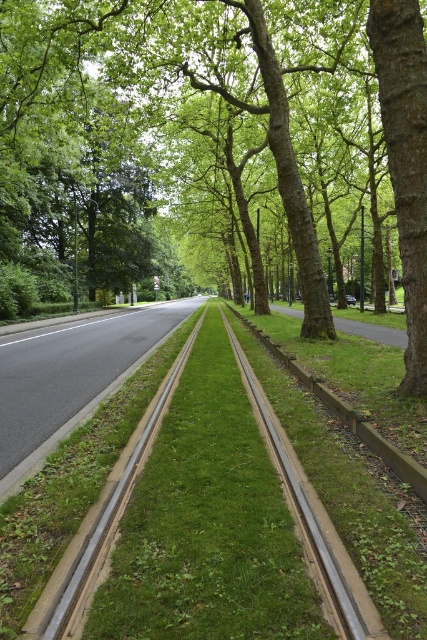
You are standing at the point closer to the camera between the two points, point (332, 234) and point (275, 468). Which point are you standing at?

You are standing at point (275, 468) because it is closer to the camera than point (332, 234).

You are standing at the origin point of the image coordinate system. Where is the brown rough bark tree at right located in terms of coordinates?

The brown rough bark tree at right is located at coordinates approximately 0.252 in the x direction and 0.951 in the y direction.